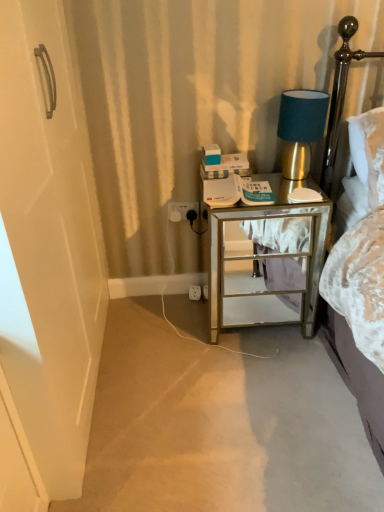
At what (x,y) coordinates should I click in order to perform the action: click on free region on the left part of white plastic electric outlet at lower center, which is the 1th electric outlet in back-to-front order. Please return your answer as a coordinate pair (x, y). The width and height of the screenshot is (384, 512). Looking at the image, I should click on (170, 304).